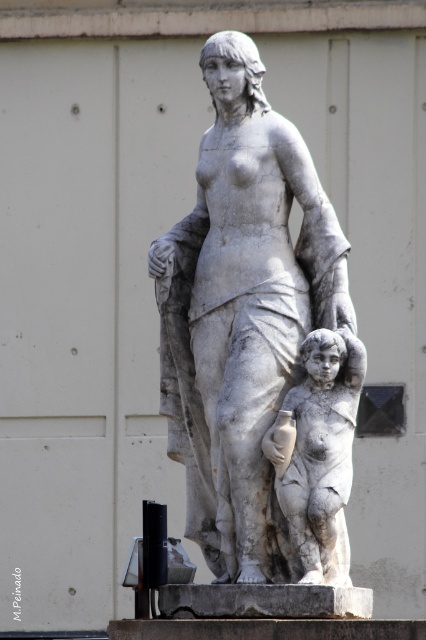
Question: Which object appears farthest from the camera in this image?

Choices:
 (A) white marble child at center
 (B) white marble statue at center

Answer: (A)

Question: Is white marble statue at center to the right of white marble child at center from the viewer's perspective?

Choices:
 (A) no
 (B) yes

Answer: (A)

Question: Does white marble statue at center have a greater width compared to white marble child at center?

Choices:
 (A) yes
 (B) no

Answer: (A)

Question: From the image, what is the correct spatial relationship of white marble statue at center in relation to white marble child at center?

Choices:
 (A) below
 (B) above

Answer: (B)